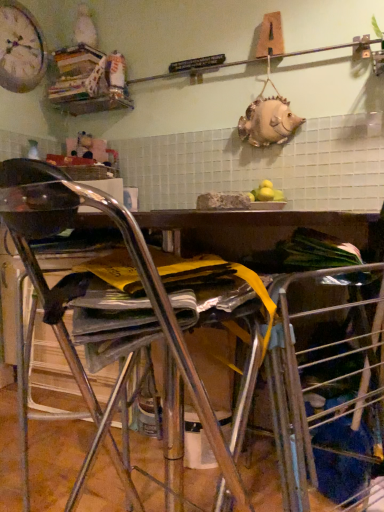
Question: Is wooden bookshelf at upper left aimed at matte white clock at upper left?

Choices:
 (A) yes
 (B) no

Answer: (A)

Question: Considering the relative sizes of wooden bookshelf at upper left and matte white clock at upper left in the image provided, is wooden bookshelf at upper left thinner than matte white clock at upper left?

Choices:
 (A) no
 (B) yes

Answer: (A)

Question: Does wooden bookshelf at upper left appear on the left side of matte white clock at upper left?

Choices:
 (A) no
 (B) yes

Answer: (A)

Question: Is wooden bookshelf at upper left shorter than matte white clock at upper left?

Choices:
 (A) yes
 (B) no

Answer: (A)

Question: Does wooden bookshelf at upper left have a smaller size compared to matte white clock at upper left?

Choices:
 (A) no
 (B) yes

Answer: (A)

Question: From the image's perspective, is matte white clock at upper left positioned above or below wooden bookshelf at upper left?

Choices:
 (A) above
 (B) below

Answer: (A)

Question: Is point (13, 49) closer or farther from the camera than point (54, 56)?

Choices:
 (A) closer
 (B) farther

Answer: (A)

Question: Do you think matte white clock at upper left is within wooden bookshelf at upper left, or outside of it?

Choices:
 (A) inside
 (B) outside

Answer: (B)

Question: Considering the positions of matte white clock at upper left and wooden bookshelf at upper left in the image, is matte white clock at upper left wider or thinner than wooden bookshelf at upper left?

Choices:
 (A) wide
 (B) thin

Answer: (B)

Question: Considering their positions, is wooden bookshelf at upper left located in front of or behind matte white clock at upper left?

Choices:
 (A) behind
 (B) front

Answer: (A)

Question: Is point 104,96 positioned closer to the camera than point 21,20?

Choices:
 (A) farther
 (B) closer

Answer: (A)

Question: Looking at their shapes, would you say wooden bookshelf at upper left is wider or thinner than matte white clock at upper left?

Choices:
 (A) thin
 (B) wide

Answer: (B)

Question: From a real-world perspective, is wooden bookshelf at upper left above or below matte white clock at upper left?

Choices:
 (A) below
 (B) above

Answer: (A)

Question: From the image's perspective, is metallic silver chair at center positioned above or below matte white clock at upper left?

Choices:
 (A) below
 (B) above

Answer: (A)

Question: Looking at their shapes, would you say metallic silver chair at center is wider or thinner than matte white clock at upper left?

Choices:
 (A) wide
 (B) thin

Answer: (A)